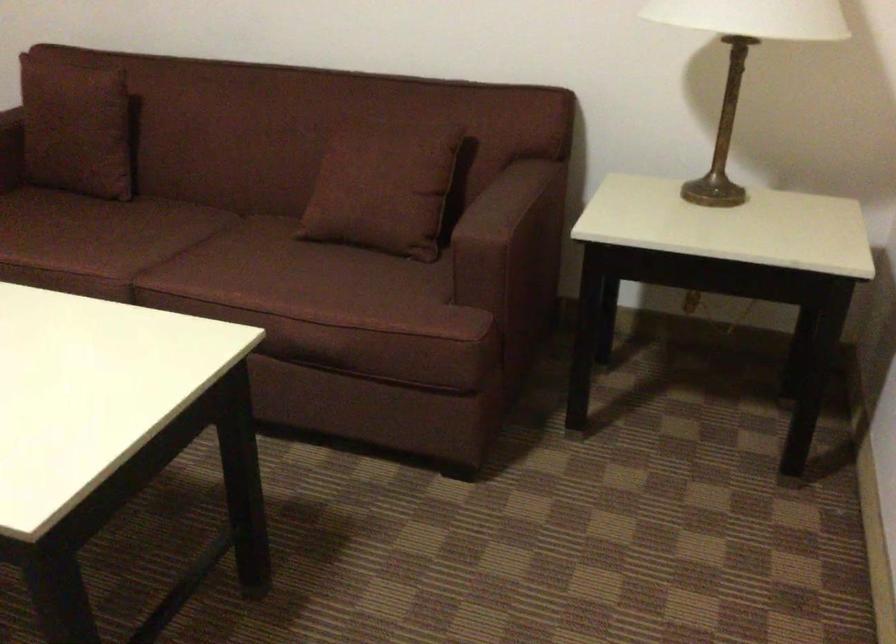
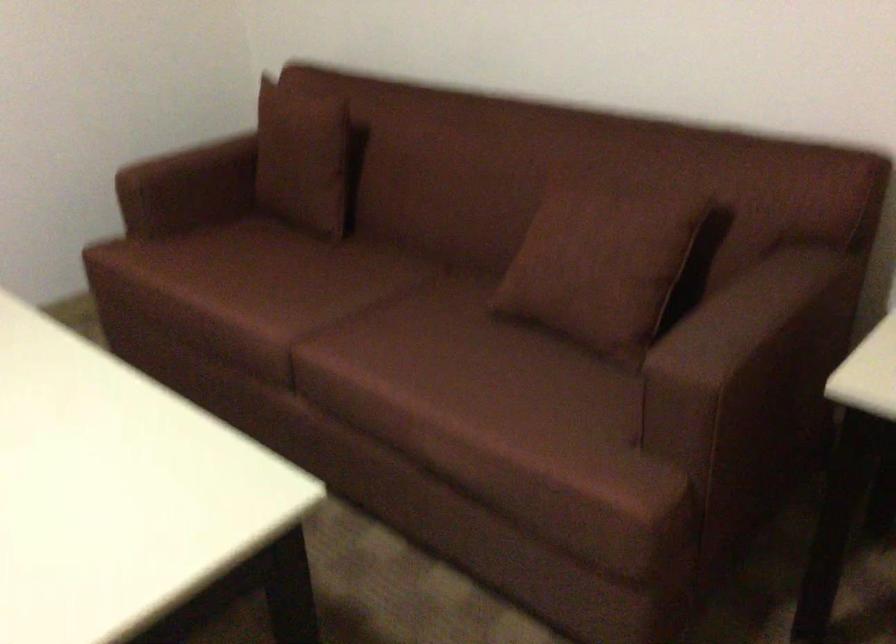
Where in the second image is the point corresponding to point 95,234 from the first image?

(286, 283)